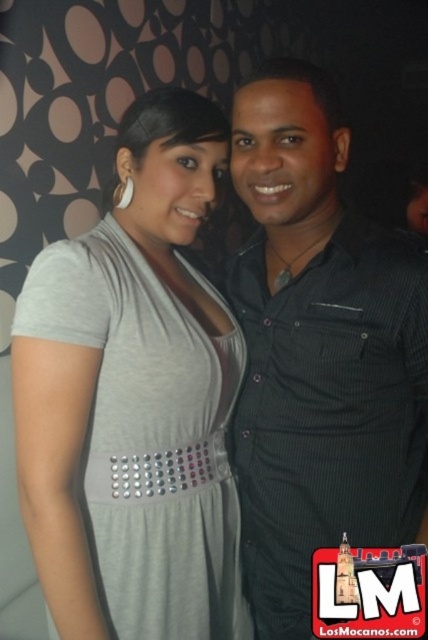
Can you confirm if black textured shirt at center is taller than gray matte dress at center?

Yes, black textured shirt at center is taller than gray matte dress at center.

Who is more forward, (287, 81) or (92, 472)?

Point (287, 81) is more forward.

You are a GUI agent. You are given a task and a screenshot of the screen. Output one action in this format:
    pyautogui.click(x=<x>, y=<y>)
    Task: Click on the black textured shirt at center
    This screenshot has height=640, width=428.
    Given the screenshot: What is the action you would take?
    pyautogui.click(x=318, y=352)